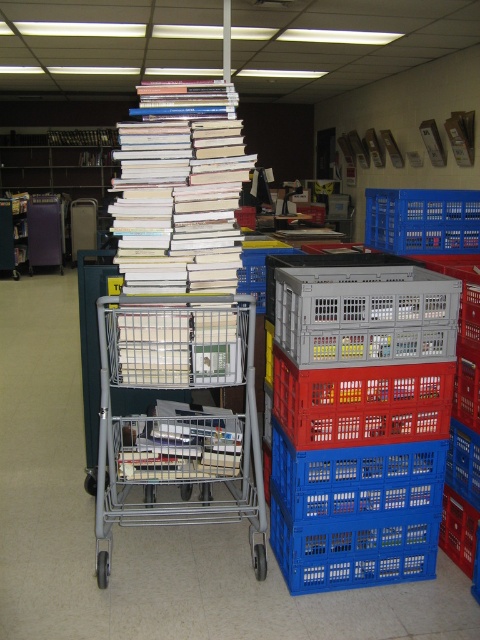
Is translucent plastic crate at center shorter than blue plastic basket at lower center?

No, translucent plastic crate at center is not shorter than blue plastic basket at lower center.

Consider the image. Between translucent plastic crate at center and blue plastic basket at lower center, which one has more height?

translucent plastic crate at center is taller.

Between point (387, 324) and point (435, 560), which one is positioned in front?

Positioned in front is point (387, 324).

Locate an element on the screen. This screenshot has width=480, height=640. translucent plastic crate at center is located at coordinates [365, 316].

Can you confirm if blue plastic basket at lower center is smaller than blue plastic crate at center?

Indeed, blue plastic basket at lower center has a smaller size compared to blue plastic crate at center.

This screenshot has height=640, width=480. I want to click on blue plastic basket at lower center, so click(354, 548).

Does point (339, 429) lie behind point (471, 440)?

No, it is in front of (471, 440).

Based on the photo, does red plastic crate at center have a lesser width compared to blue plastic crate at lower right?

Incorrect, red plastic crate at center's width is not less than blue plastic crate at lower right's.

Is point (422, 396) more distant than point (465, 456)?

No, (422, 396) is in front of (465, 456).

Where is `red plastic crate at center`? The height and width of the screenshot is (640, 480). red plastic crate at center is located at coordinates [361, 403].